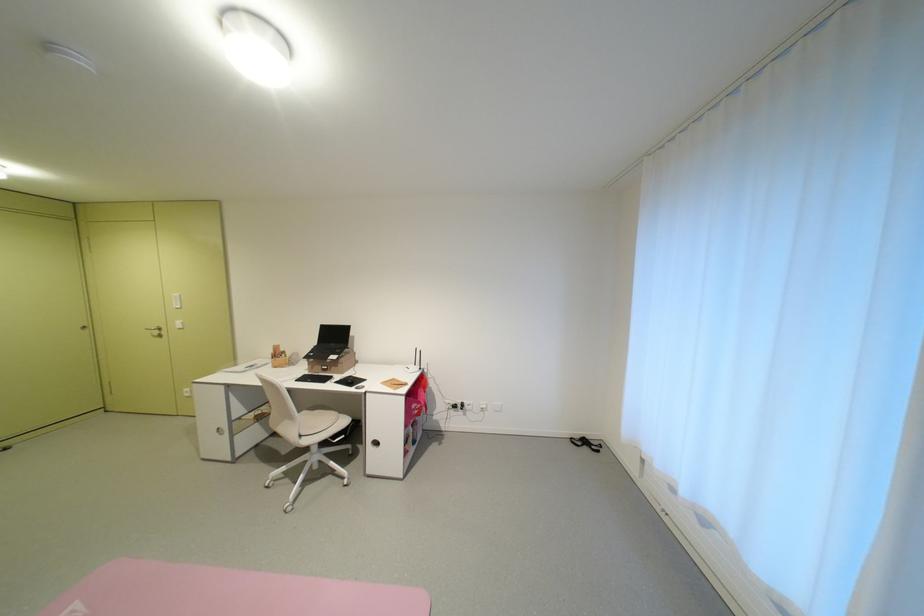
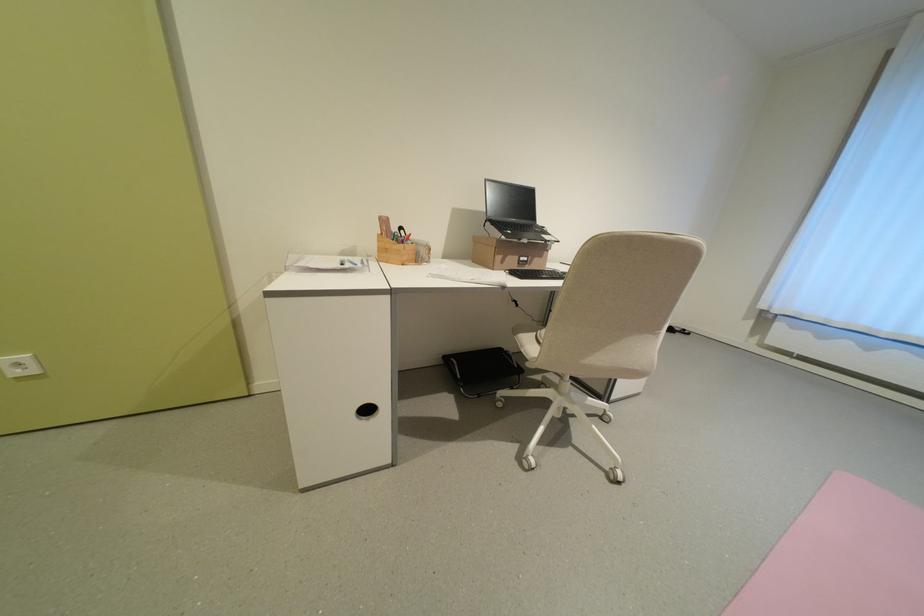
The point at [322,355] is marked in the first image. Where is the corresponding point in the second image?

(518, 233)